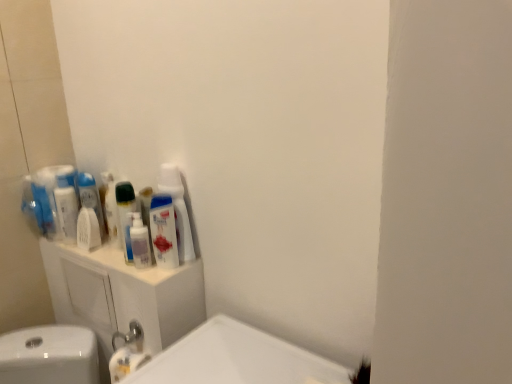
Image resolution: width=512 pixels, height=384 pixels. Identify the location of white glossy mouthwash at left, which ranks as the 2th mouthwash in left-to-right order. (91, 199).

What is the approximate width of white glossy bottle at upper center?

white glossy bottle at upper center is 2.70 inches wide.

I want to click on white plastic cabinet at upper left, so click(x=123, y=294).

Does white plastic mouthwash at left, the 5th mouthwash when ordered from right to left, have a lesser width compared to translucent plastic mouthwash at center, the second mouthwash positioned from the right?

Correct, the width of white plastic mouthwash at left, the 5th mouthwash when ordered from right to left, is less than that of translucent plastic mouthwash at center, the second mouthwash positioned from the right.

From a real-world perspective, between white plastic mouthwash at left, which is the 1th mouthwash from left to right, and translucent plastic mouthwash at center, which is the fourth mouthwash from left to right, who is vertically higher?

white plastic mouthwash at left, which is the 1th mouthwash from left to right, is physically above.

Is point (71, 226) closer or farther from the camera than point (144, 226)?

Point (71, 226) appears to be farther away from the viewer than point (144, 226).

Relative to white glossy mouthwash at left, which ranks as the 2th mouthwash in left-to-right order, is translucent plastic mouthwash at center, which is the fourth mouthwash from left to right, in front or behind?

translucent plastic mouthwash at center, which is the fourth mouthwash from left to right, is in front of white glossy mouthwash at left, which ranks as the 2th mouthwash in left-to-right order.

From a real-world perspective, is translucent plastic mouthwash at center, the second mouthwash positioned from the right, located beneath white glossy mouthwash at left, the fourth mouthwash positioned from the right?

Yes, from a real-world perspective, translucent plastic mouthwash at center, the second mouthwash positioned from the right, is under white glossy mouthwash at left, the fourth mouthwash positioned from the right.

Between point (145, 232) and point (97, 197), which one is positioned in front?

Positioned in front is point (145, 232).

How different are the orientations of translucent plastic mouthwash at center, the second mouthwash positioned from the right, and white glossy mouthwash at left, the fourth mouthwash positioned from the right, in degrees?

The angle between the facing direction of translucent plastic mouthwash at center, the second mouthwash positioned from the right, and the facing direction of white glossy mouthwash at left, the fourth mouthwash positioned from the right, is 0.00347 degrees.

What's the angular difference between white plastic cabinet at upper left and translucent plastic mouthwash at center, the second mouthwash positioned from the right,'s facing directions?

The angular difference between white plastic cabinet at upper left and translucent plastic mouthwash at center, the second mouthwash positioned from the right, is 0.368 degrees.

How distant is white plastic cabinet at upper left from translucent plastic mouthwash at center, the second mouthwash positioned from the right?

They are 8.35 inches apart.

Can you confirm if white plastic cabinet at upper left is bigger than translucent plastic mouthwash at center, the second mouthwash positioned from the right?

Yes, white plastic cabinet at upper left is bigger than translucent plastic mouthwash at center, the second mouthwash positioned from the right.

The image size is (512, 384). Identify the location of bathroom cabinet on the left of translucent plastic mouthwash at center, which is the fourth mouthwash from left to right. (123, 294).

Who is more distant, translucent plastic mouthwash at center, which is the fourth mouthwash from left to right, or white matte mouthwash at left, placed as the 3th mouthwash when sorted from right to left?

white matte mouthwash at left, placed as the 3th mouthwash when sorted from right to left, is behind.

Based on the photo, could white matte mouthwash at left, the 3th mouthwash when ordered from left to right, be considered to be inside translucent plastic mouthwash at center, the second mouthwash positioned from the right?

No, white matte mouthwash at left, the 3th mouthwash when ordered from left to right, is not inside translucent plastic mouthwash at center, the second mouthwash positioned from the right.

From a real-world perspective, is translucent plastic mouthwash at center, which is the fourth mouthwash from left to right, physically above white matte mouthwash at left, the 3th mouthwash when ordered from left to right?

Yes, from a real-world perspective, translucent plastic mouthwash at center, which is the fourth mouthwash from left to right, is above white matte mouthwash at left, the 3th mouthwash when ordered from left to right.

Which is in front, point (161, 211) or point (184, 200)?

Positioned in front is point (161, 211).

Would you consider translucent plastic mouthwash at upper left, the 1th mouthwash viewed from the right, to be distant from white glossy bottle at upper center?

They are positioned close to each other.

This screenshot has width=512, height=384. Find the location of `cleaning product above the translucent plastic mouthwash at upper left, which is the fifth mouthwash in left-to-right order (from the image's perspective)`. cleaning product above the translucent plastic mouthwash at upper left, which is the fifth mouthwash in left-to-right order (from the image's perspective) is located at coordinates (177, 209).

Which is more distant, (189, 224) or (89, 181)?

Positioned behind is point (89, 181).

Is white glossy bottle at upper center beside white glossy mouthwash at left, the fourth mouthwash positioned from the right?

No, white glossy bottle at upper center is not touching white glossy mouthwash at left, the fourth mouthwash positioned from the right.

How many degrees apart are the facing directions of white glossy bottle at upper center and white glossy mouthwash at left, which ranks as the 2th mouthwash in left-to-right order?

The facing directions of white glossy bottle at upper center and white glossy mouthwash at left, which ranks as the 2th mouthwash in left-to-right order, are 0.368 degrees apart.

At what (x,y) coordinates should I click in order to perform the action: click on mouthwash that is the 2nd object located above the white glossy bottle at upper center (from the image's perspective). Please return your answer as a coordinate pair (x, y). This screenshot has width=512, height=384. Looking at the image, I should click on (91, 199).

From the image's perspective, which is below, white plastic cabinet at upper left or white glossy mouthwash at left, the fourth mouthwash positioned from the right?

white plastic cabinet at upper left, from the image's perspective.

Which is in front, point (48, 241) or point (99, 219)?

Point (48, 241)

Looking at this image, is white plastic cabinet at upper left at the left side of white glossy mouthwash at left, the fourth mouthwash positioned from the right?

In fact, white plastic cabinet at upper left is to the right of white glossy mouthwash at left, the fourth mouthwash positioned from the right.

Considering the sizes of objects white plastic cabinet at upper left and white glossy mouthwash at left, which ranks as the 2th mouthwash in left-to-right order, in the image provided, who is wider, white plastic cabinet at upper left or white glossy mouthwash at left, which ranks as the 2th mouthwash in left-to-right order,?

Wider between the two is white plastic cabinet at upper left.

Locate an element on the screen. the 3rd mouthwash counting from the left side of the translucent plastic mouthwash at center, which is the fourth mouthwash from left to right is located at coordinates click(67, 202).

Locate an element on the screen. This screenshot has width=512, height=384. the 2nd mouthwash counting from the right side of the white glossy mouthwash at left, which ranks as the 2th mouthwash in left-to-right order is located at coordinates tap(140, 243).

From the image, which object appears to be farther from translucent plastic mouthwash at upper left, the 1th mouthwash viewed from the right, white glossy mouthwash at left, the fourth mouthwash positioned from the right, or white plastic cabinet at upper left?

white glossy mouthwash at left, the fourth mouthwash positioned from the right, is further to translucent plastic mouthwash at upper left, the 1th mouthwash viewed from the right.

Which object lies further to the anchor point translucent plastic mouthwash at upper left, which is the fifth mouthwash in left-to-right order, white plastic cabinet at upper left or translucent plastic mouthwash at center, the second mouthwash positioned from the right?

Among the two, white plastic cabinet at upper left is located further to translucent plastic mouthwash at upper left, which is the fifth mouthwash in left-to-right order.

From the image, which object appears to be farther from white glossy bottle at upper center, white plastic mouthwash at left, the 5th mouthwash when ordered from right to left, or white matte mouthwash at left, placed as the 3th mouthwash when sorted from right to left?

white plastic mouthwash at left, the 5th mouthwash when ordered from right to left, is further to white glossy bottle at upper center.

Based on their spatial positions, is white glossy mouthwash at left, which ranks as the 2th mouthwash in left-to-right order, or translucent plastic mouthwash at upper left, the 1th mouthwash viewed from the right, further from white plastic cabinet at upper left?

white glossy mouthwash at left, which ranks as the 2th mouthwash in left-to-right order, lies further to white plastic cabinet at upper left than the other object.

Considering their positions, is white plastic cabinet at upper left positioned further to white matte mouthwash at left, the 3th mouthwash when ordered from left to right, than white glossy bottle at upper center?

white glossy bottle at upper center is positioned further to the anchor white matte mouthwash at left, the 3th mouthwash when ordered from left to right.

From the image, which object appears to be nearer to white plastic cabinet at upper left, white glossy bottle at upper center or translucent plastic mouthwash at upper left, which is the fifth mouthwash in left-to-right order?

translucent plastic mouthwash at upper left, which is the fifth mouthwash in left-to-right order, lies closer to white plastic cabinet at upper left than the other object.

Estimate the real-world distances between objects in this image. Which object is further from white glossy mouthwash at left, which ranks as the 2th mouthwash in left-to-right order, white glossy bottle at upper center or translucent plastic mouthwash at center, the second mouthwash positioned from the right?

Among the two, white glossy bottle at upper center is located further to white glossy mouthwash at left, which ranks as the 2th mouthwash in left-to-right order.

Considering their positions, is white plastic mouthwash at left, which is the 1th mouthwash from left to right, positioned further to white plastic cabinet at upper left than translucent plastic mouthwash at upper left, which is the fifth mouthwash in left-to-right order?

white plastic mouthwash at left, which is the 1th mouthwash from left to right, is further to white plastic cabinet at upper left.

Locate an element on the screen. The width and height of the screenshot is (512, 384). cleaning product between white plastic mouthwash at left, which is the 1th mouthwash from left to right, and white plastic cabinet at upper left from top to bottom is located at coordinates (177, 209).

Locate an element on the screen. mouthwash between white plastic mouthwash at left, which is the 1th mouthwash from left to right, and white matte mouthwash at left, the 3th mouthwash when ordered from left to right, from left to right is located at coordinates (91, 199).

At what (x,y) coordinates should I click in order to perform the action: click on mouthwash between white matte mouthwash at left, the 3th mouthwash when ordered from left to right, and translucent plastic mouthwash at upper left, which is the fifth mouthwash in left-to-right order, from left to right. Please return your answer as a coordinate pair (x, y). The image size is (512, 384). Looking at the image, I should click on (140, 243).

The image size is (512, 384). I want to click on mouthwash located between white glossy mouthwash at left, which ranks as the 2th mouthwash in left-to-right order, and translucent plastic mouthwash at center, the second mouthwash positioned from the right, in the left-right direction, so click(88, 229).